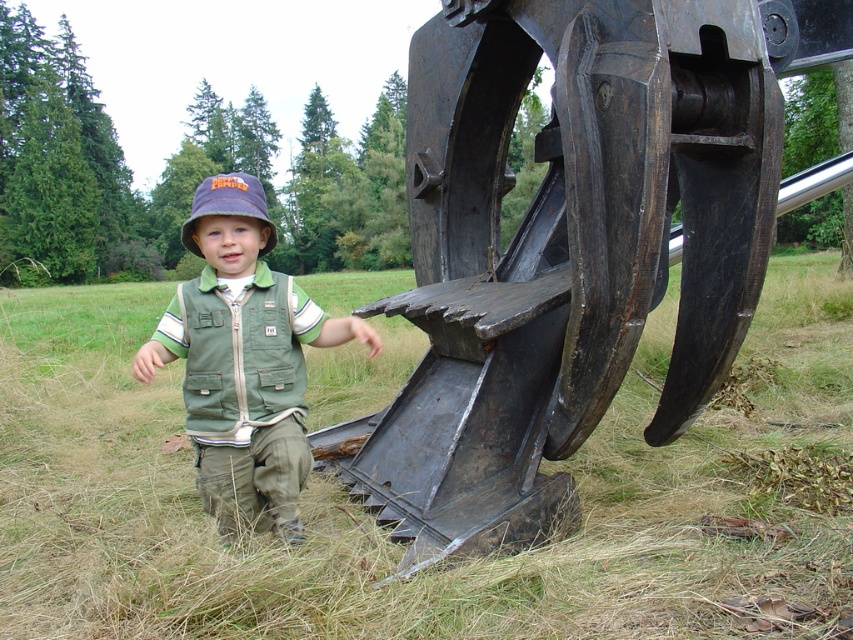
Question: Does rusty metal claw at lower right appear on the left side of purple fabric bucket hat at center?

Choices:
 (A) yes
 (B) no

Answer: (B)

Question: Does rusty metal claw at lower right appear on the left side of green fabric vest at center?

Choices:
 (A) yes
 (B) no

Answer: (B)

Question: Which point is closer to the camera?

Choices:
 (A) (39, 515)
 (B) (695, 385)
 (C) (263, 205)

Answer: (C)

Question: Which of the following is the farthest from the observer?

Choices:
 (A) green grass at lower left
 (B) rusty metal claw at lower right

Answer: (B)

Question: Which object is farther from the camera taking this photo?

Choices:
 (A) rusty metal claw at lower right
 (B) green grass at lower left
 (C) green fabric vest at center
 (D) purple fabric bucket hat at center

Answer: (D)

Question: Does green grass at lower left appear on the left side of purple fabric bucket hat at center?

Choices:
 (A) no
 (B) yes

Answer: (A)